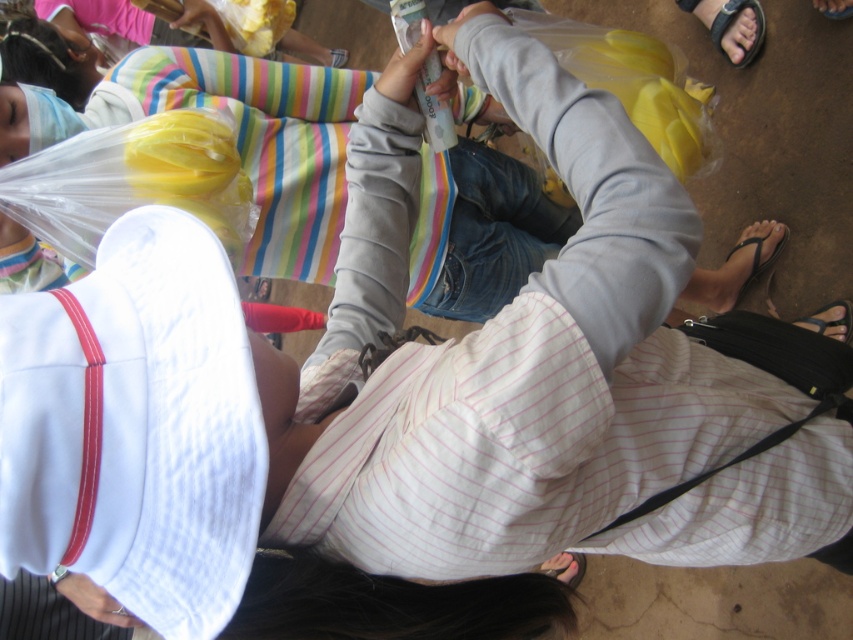
Which of these two, yellow plastic bag at upper left or matte yellow plastic bag at upper center, stands taller?

yellow plastic bag at upper left

Describe the element at coordinates (193, 172) in the screenshot. I see `yellow plastic bag at upper left` at that location.

Describe the element at coordinates (193, 172) in the screenshot. This screenshot has height=640, width=853. I see `yellow plastic bag at upper left` at that location.

Image resolution: width=853 pixels, height=640 pixels. Identify the location of yellow plastic bag at upper left. click(193, 172).

Does point (213, 221) lie behind point (86, 605)?

Yes, point (213, 221) is behind point (86, 605).

Does yellow plastic bag at upper left appear over white fabric at lower left?

Indeed, yellow plastic bag at upper left is positioned over white fabric at lower left.

The image size is (853, 640). What do you see at coordinates (193, 172) in the screenshot?
I see `yellow plastic bag at upper left` at bounding box center [193, 172].

Locate an element on the screen. The width and height of the screenshot is (853, 640). yellow plastic bag at upper left is located at coordinates (193, 172).

In the scene shown: Can you confirm if matte plastic bag at upper center is positioned to the right of matte yellow plastic bag at upper center?

Yes, matte plastic bag at upper center is to the right of matte yellow plastic bag at upper center.

Is matte plastic bag at upper center below matte yellow plastic bag at upper center?

Yes.

This screenshot has height=640, width=853. Describe the element at coordinates (405, 67) in the screenshot. I see `matte plastic bag at upper center` at that location.

Identify the location of matte plastic bag at upper center. This screenshot has height=640, width=853. (405, 67).